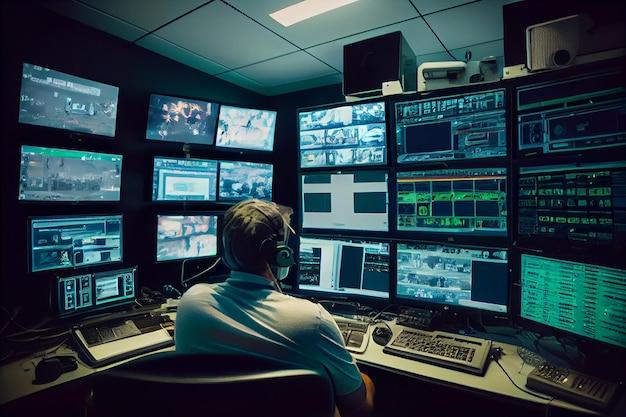
Locate an element on the screen. Image resolution: width=626 pixels, height=417 pixels. keyboards is located at coordinates (119, 324), (352, 331), (436, 340), (572, 385).